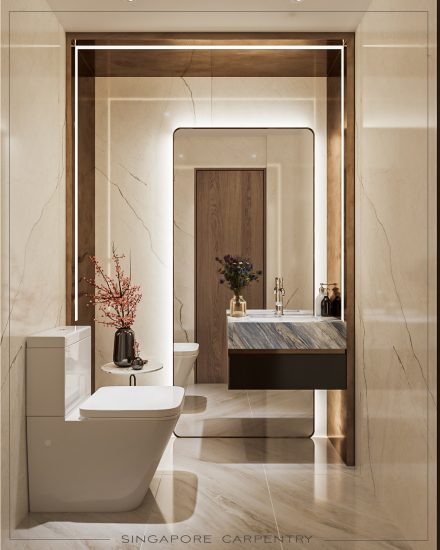
You are a GUI agent. You are given a task and a screenshot of the screen. Output one action in this format:
    pyautogui.click(x=<x>, y=<y>)
    Task: Click on the toilet reflection in mirror
    
    Given the screenshot: What is the action you would take?
    pyautogui.click(x=181, y=361)